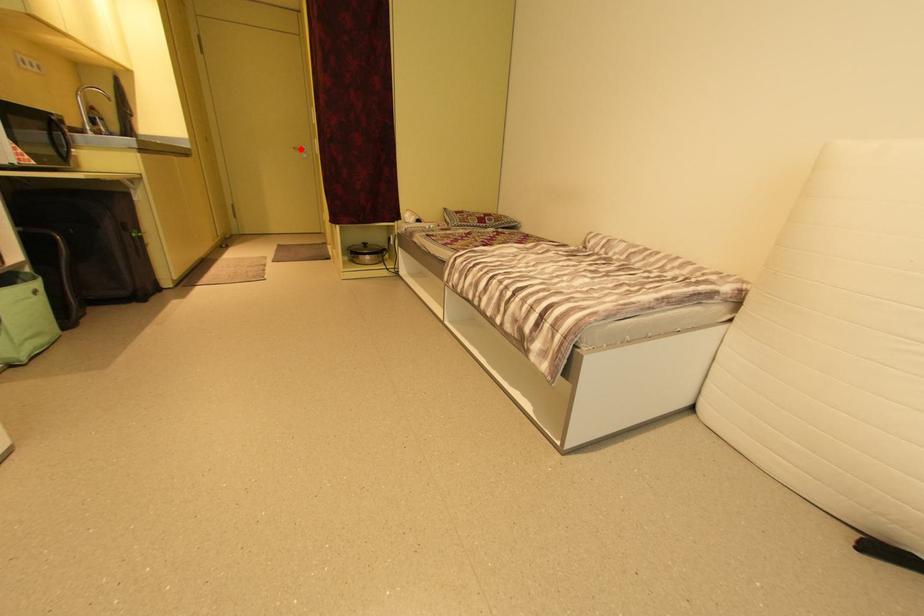
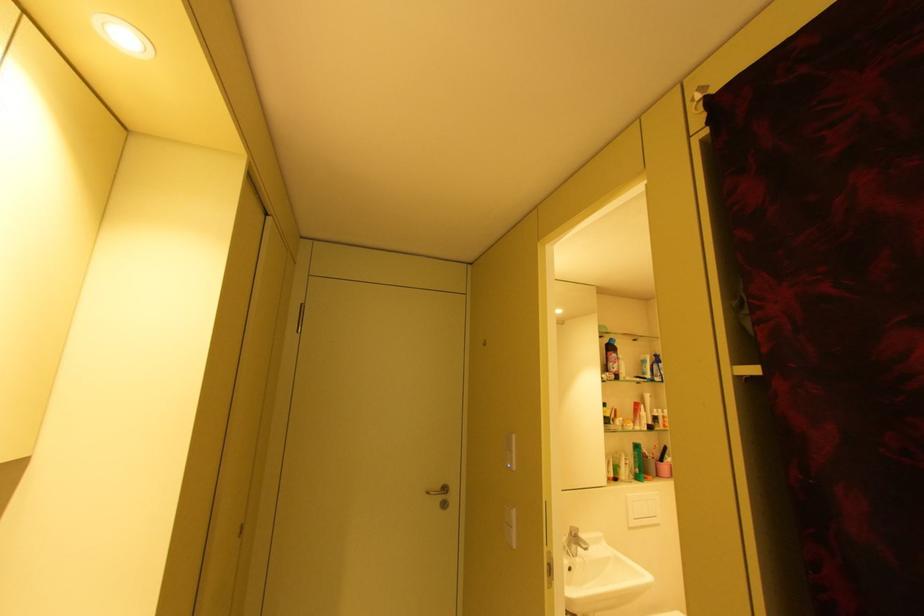
Where in the second image is the point corresponding to the highlighted location from the first image?

(434, 493)